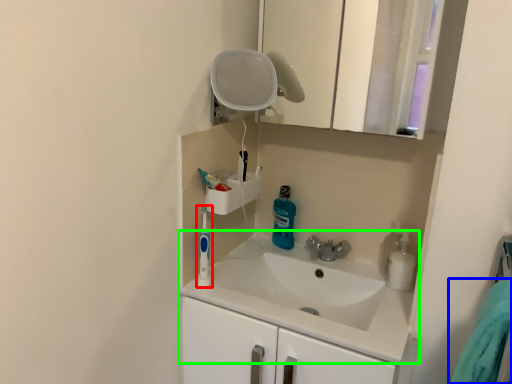
Question: Which object is the closest to the toiletry (highlighted by a red box)? Choose among these: bath towel (highlighted by a blue box) or sink (highlighted by a green box).

Choices:
 (A) bath towel
 (B) sink

Answer: (B)